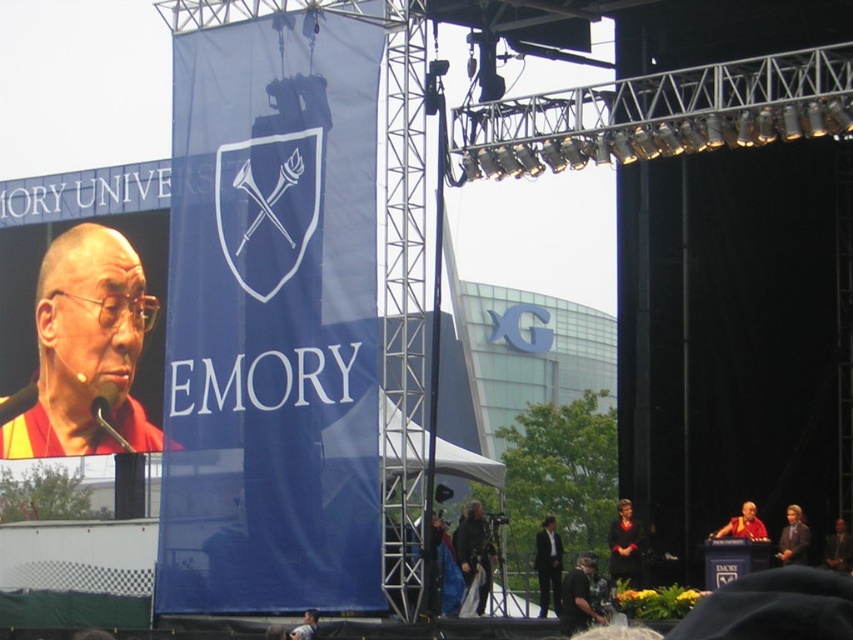
Question: Which of these objects is positioned farthest from the smooth brown suit at lower right?

Choices:
 (A) black fabric at center
 (B) black suit at center
 (C) dark brown leather jacket at center
 (D) yellow/yellowish fabric at left

Answer: (D)

Question: Does smooth brown suit at lower right lie behind red silk robe at center?

Choices:
 (A) yes
 (B) no

Answer: (A)

Question: Where is yellow/yellowish fabric at left located in relation to black suit at center in the image?

Choices:
 (A) below
 (B) above

Answer: (B)

Question: Which point is farther from the camera taking this photo?

Choices:
 (A) (796, 538)
 (B) (828, 538)
 (C) (618, 540)
 (D) (96, 333)

Answer: (D)

Question: Is yellow/yellowish fabric at left above dark brown leather jacket at center?

Choices:
 (A) yes
 (B) no

Answer: (A)

Question: Which object is positioned closest to the black suit at center?

Choices:
 (A) black fabric at center
 (B) yellow/yellowish fabric at left
 (C) red silk robe at center

Answer: (A)